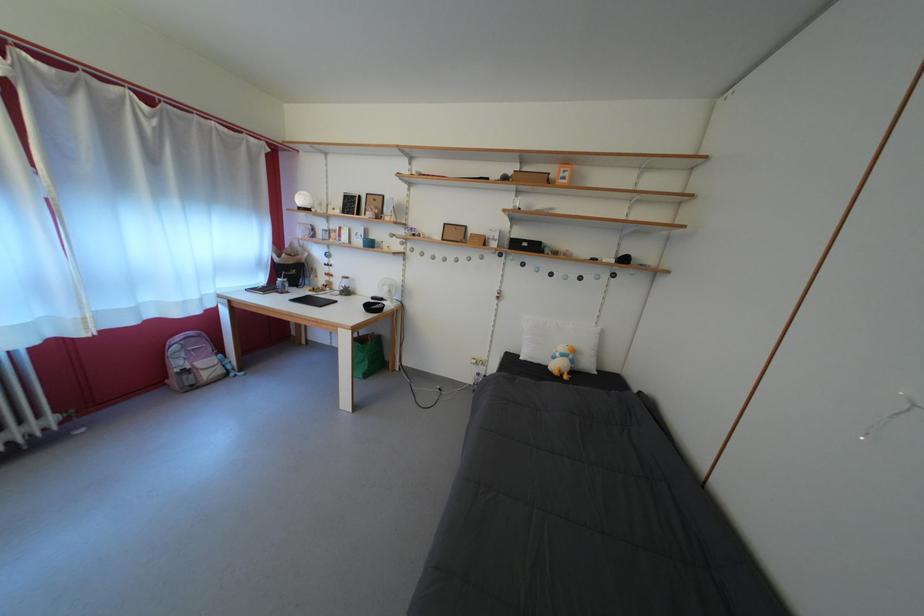
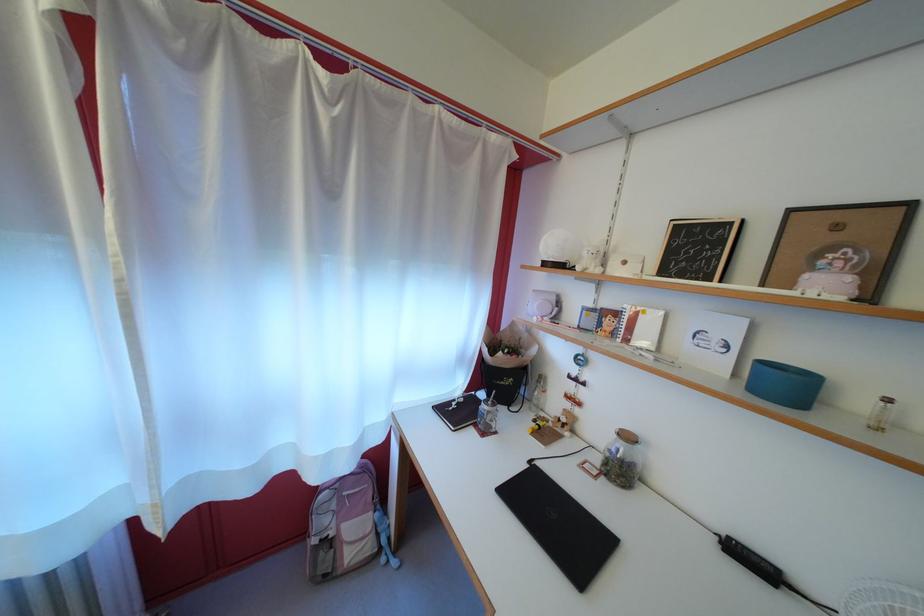
The point at (240,381) is marked in the first image. Where is the corresponding point in the second image?

(392, 565)